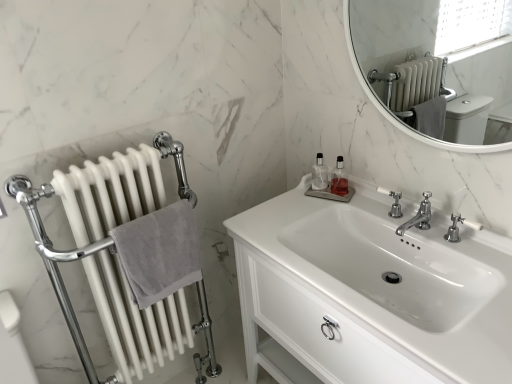
The image size is (512, 384). In order to click on free space between clear glass bottle at upper center, the first toiletry when ordered from right to left, and polished chrome faucet at upper right in this screenshot , I will do `click(359, 207)`.